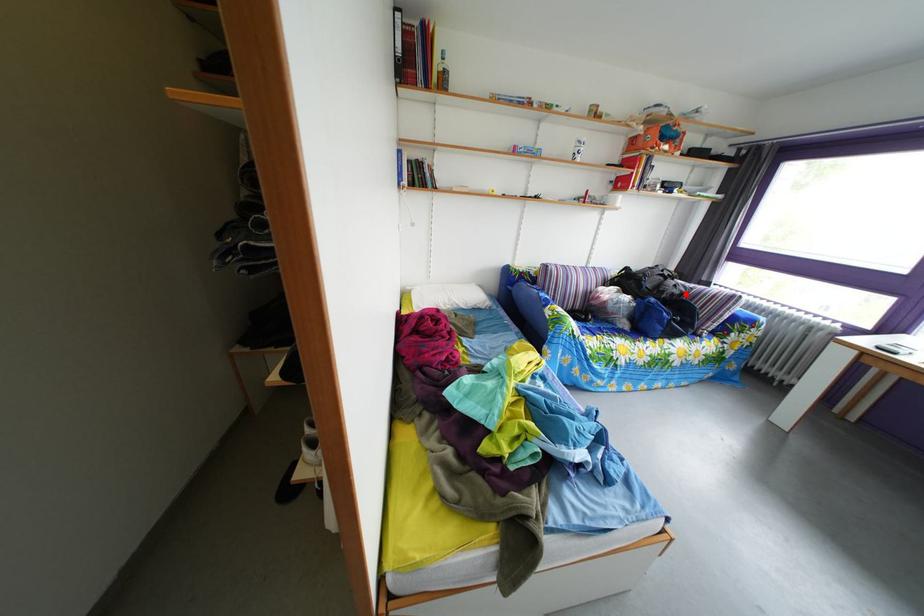
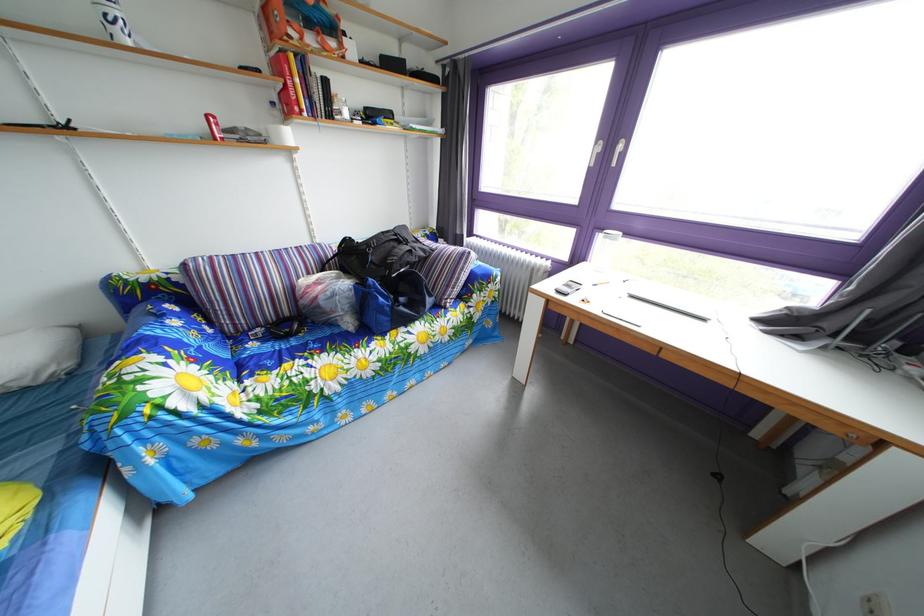
Question: I am providing you with two images of the same scene from different viewpoints. A red point is shown in image1. For the corresponding object point in image2, is it positioned nearer or farther from the camera?

Choices:
 (A) Nearer
 (B) Farther

Answer: (A)